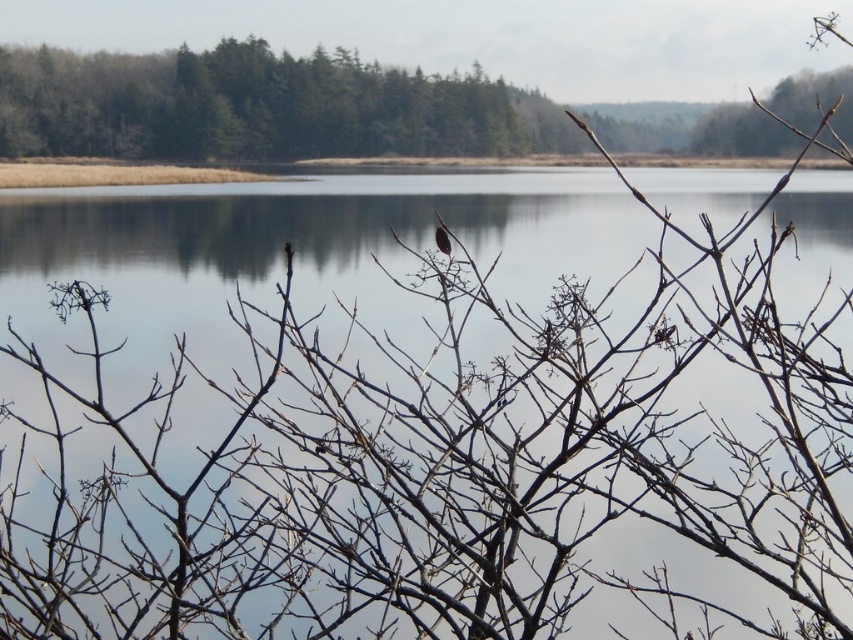
You are standing at the edge of the scene and want to walk to the transparent water at center. According to the coordinates given, in which direction should you move? Please specify the direction as left, right, forward, or backward.

The transparent water at center is located at coordinates point 0.667 on the x axis and 0.510 on the y axis. Since you are at the edge, you should move forward to reach it.

You are a birdwatcher observing the scene. You notice the brown matte bird at center and the transparent water at center. Which object is positioned lower in the image?

The transparent water at center is located below the brown matte bird at center, so the transparent water at center is positioned lower in the image.

You are a bird watcher standing at the edge of the lake. You see the transparent water at center and the brown matte bird at center. How far apart are these two objects?

The transparent water at center is 16.72 inches away from the brown matte bird at center.